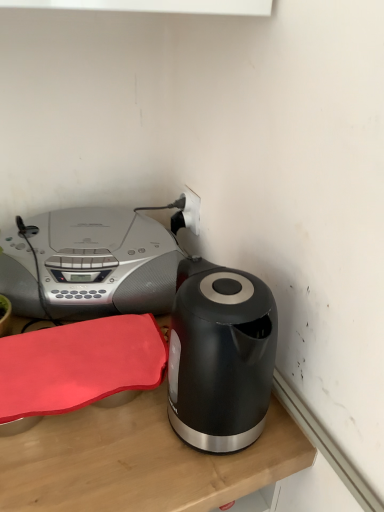
Question: Relative to white plastic plug at upper center, is wooden table at lower left in front or behind?

Choices:
 (A) front
 (B) behind

Answer: (A)

Question: Based on their positions, is wooden table at lower left located to the left or right of white plastic plug at upper center?

Choices:
 (A) right
 (B) left

Answer: (B)

Question: Based on their relative distances, which object is farther from the wooden table at lower left?

Choices:
 (A) white plastic plug at upper center
 (B) satin silver stereo at upper left

Answer: (A)

Question: Which is farther from the white plastic plug at upper center?

Choices:
 (A) satin silver stereo at upper left
 (B) wooden table at lower left

Answer: (B)